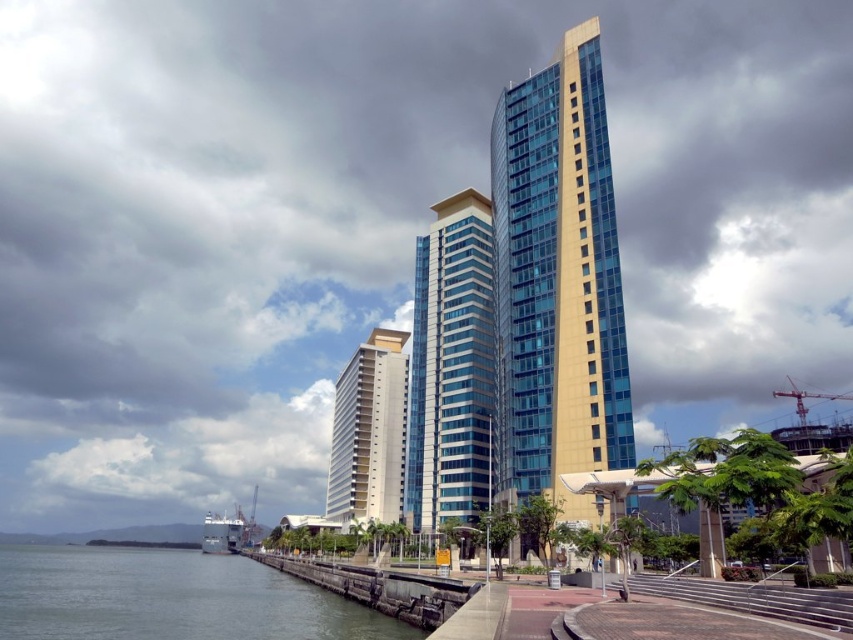
Question: Which object is the closest to the sleek glass building at center?

Choices:
 (A) green water at lower left
 (B) white smooth building at center
 (C) gold glass building at center

Answer: (C)

Question: Which point is closer to the camera taking this photo?

Choices:
 (A) (463, 365)
 (B) (184, 554)
 (C) (347, 378)

Answer: (A)

Question: Does gold glass building at center appear on the right side of sleek glass building at center?

Choices:
 (A) no
 (B) yes

Answer: (B)

Question: Can you confirm if sleek glass building at center is thinner than white smooth building at center?

Choices:
 (A) yes
 (B) no

Answer: (A)

Question: Can you confirm if gold glass building at center is smaller than sleek glass building at center?

Choices:
 (A) yes
 (B) no

Answer: (A)

Question: Which point is farther to the camera?

Choices:
 (A) green water at lower left
 (B) sleek glass building at center
 (C) gold glass building at center

Answer: (B)